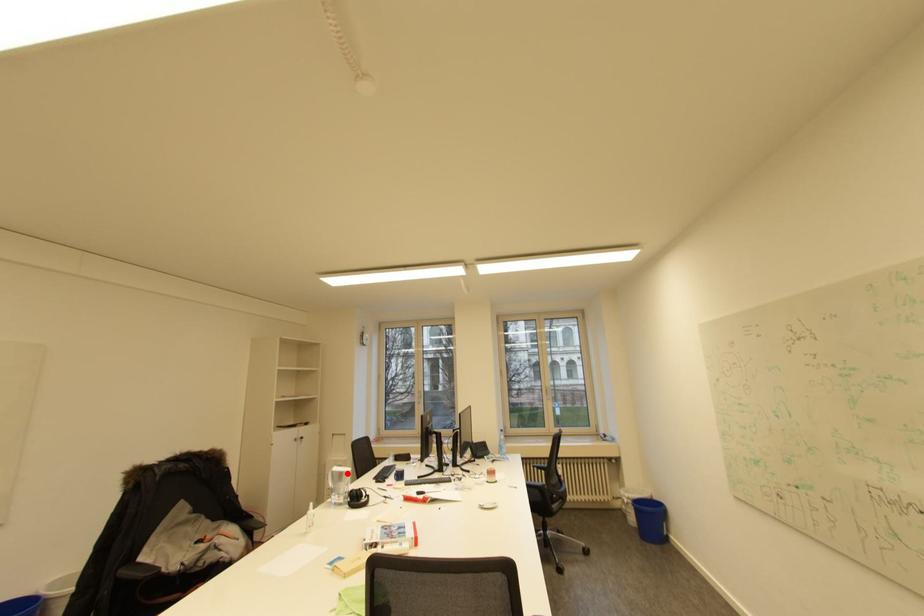
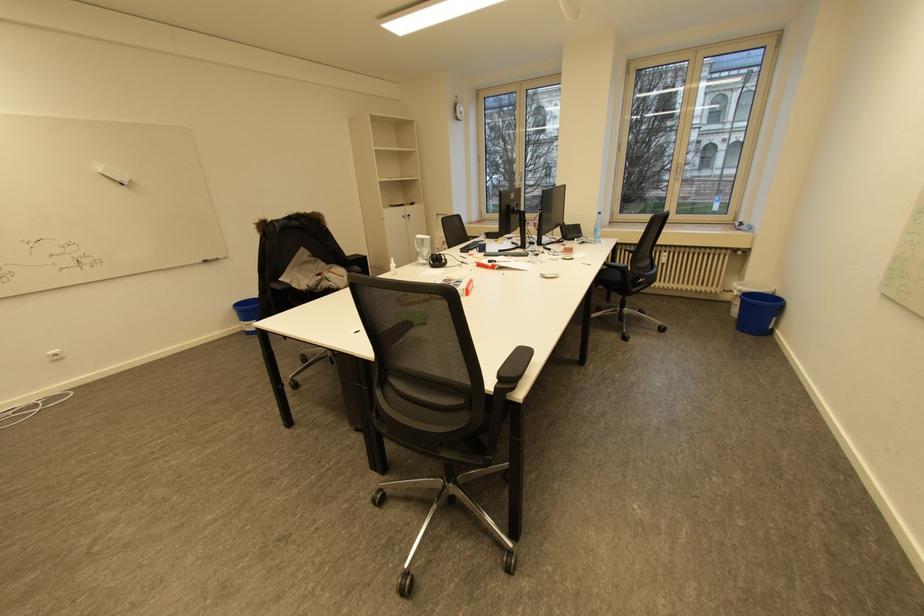
The point at the highlighted location is marked in the first image. Where is the corresponding point in the second image?

(428, 240)